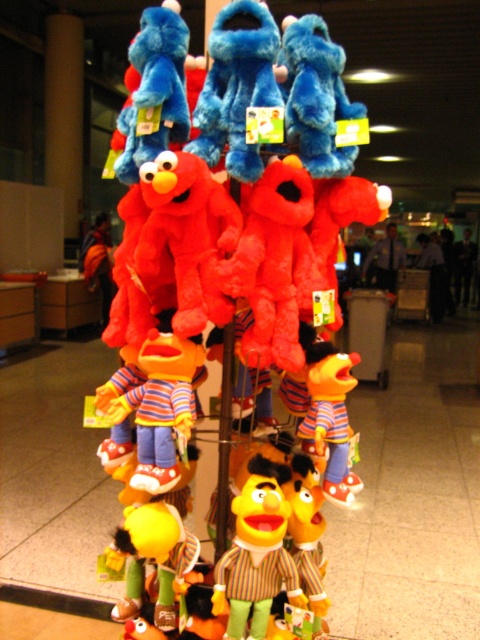
Question: Is fluffy plush at center bigger than yellow plush bert at center?

Choices:
 (A) yes
 (B) no

Answer: (A)

Question: Which of these objects is positioned closest to the yellow plush bert at center?

Choices:
 (A) fluffy plush at center
 (B) matte plush bert at center

Answer: (B)

Question: Estimate the real-world distances between objects in this image. Which object is farther from the striped fabric bert at center?

Choices:
 (A) matte plush bert at center
 (B) fluffy plush at center
 (C) yellow plush bert at center

Answer: (B)

Question: Can you confirm if fluffy plush at center is positioned to the right of striped fabric bert at center?

Choices:
 (A) yes
 (B) no

Answer: (B)

Question: Is fluffy plush at center further to camera compared to matte plush bert at center?

Choices:
 (A) yes
 (B) no

Answer: (B)

Question: Among these points, which one is farthest from the camera?

Choices:
 (A) (235, 566)
 (B) (220, 458)

Answer: (B)